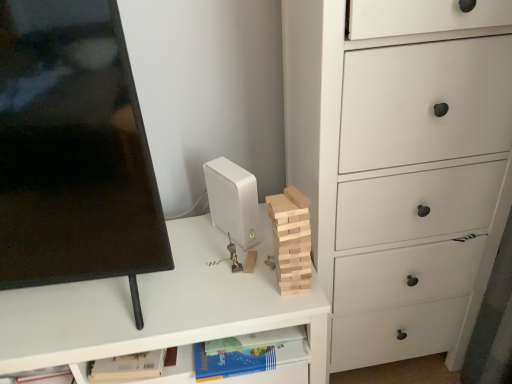
This screenshot has height=384, width=512. In order to click on vacant area that lies to the right of black glossy computer monitor at left in this screenshot , I will do `click(212, 284)`.